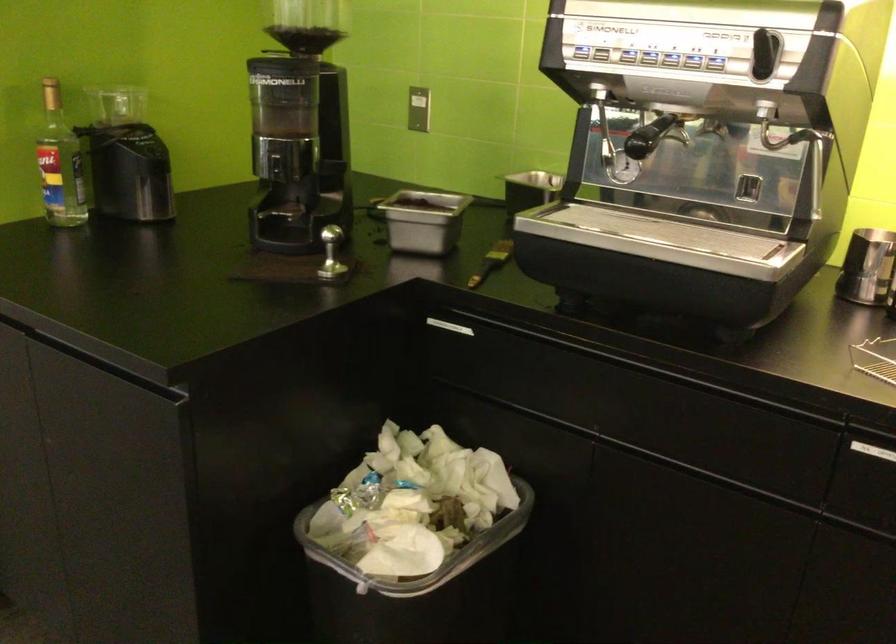
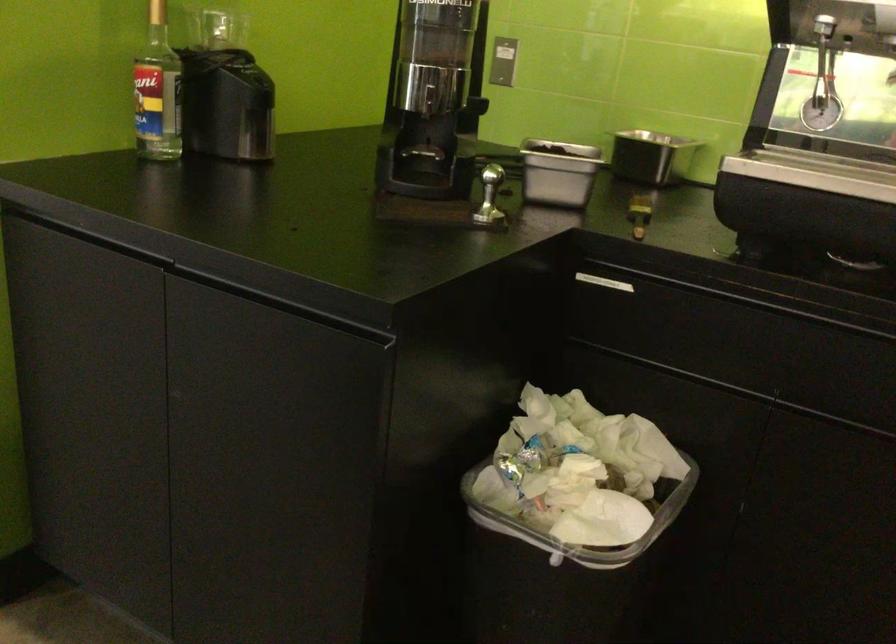
The point at (389, 554) is marked in the first image. Where is the corresponding point in the second image?

(581, 524)